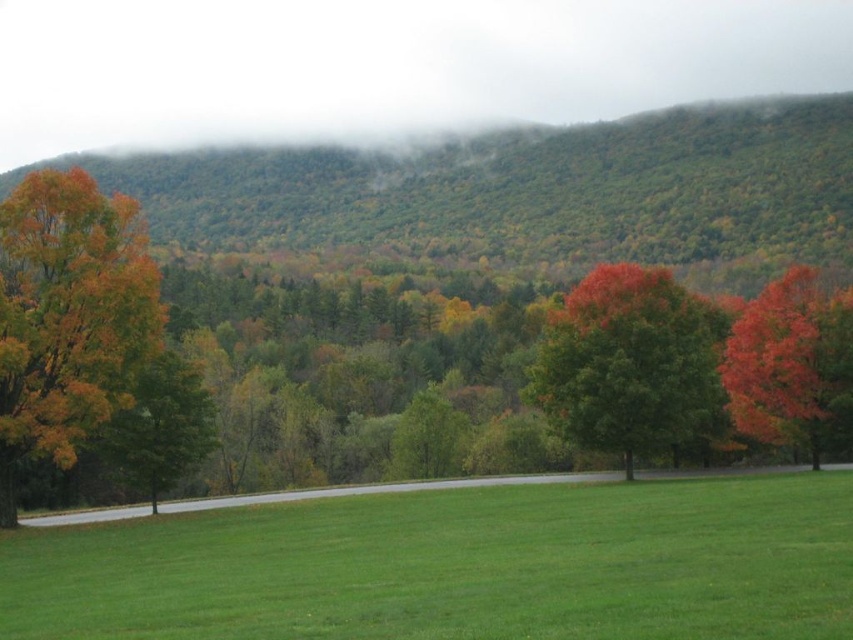
You are standing at the center of the meadow and want to find the shiny red tree at center. According to the coordinates provided, in which direction should you walk to locate it?

The shiny red tree at center is located at coordinates point [631,364]. Since you are at the center of the meadow, you should walk towards the direction of the coordinates to find it.

You are standing in the meadow looking towards the road. You see the shiny red tree at center and the green matte tree at left. Which tree would appear taller from your current position?

The shiny red tree at center appears much taller than the green matte tree at left from your current position in the meadow.

You are standing at the edge of the green grassy field at center and want to look at the green matte tree at left. In which direction should you turn your head to see it?

The green grassy field at center is above the green matte tree at left, so you should look downward to see the green matte tree at left.